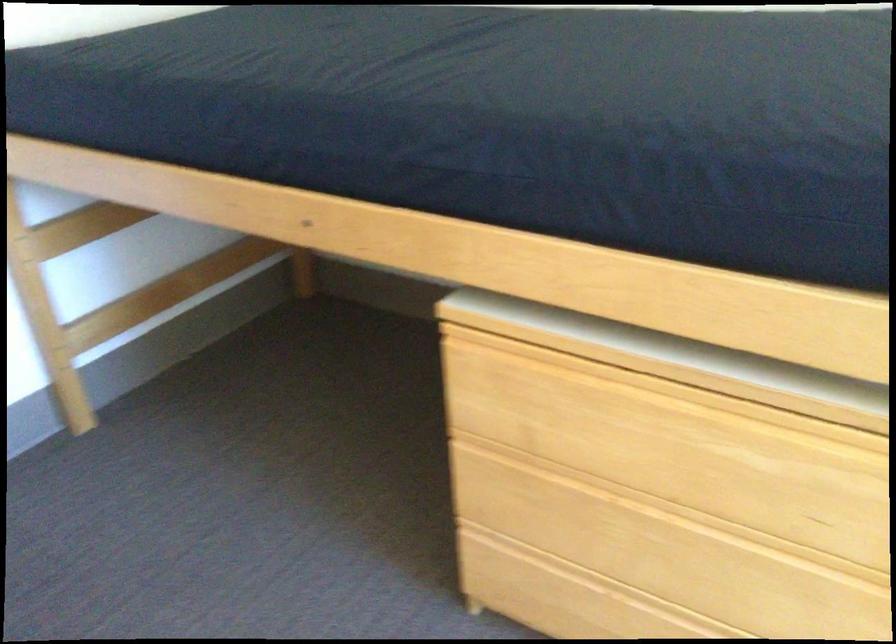
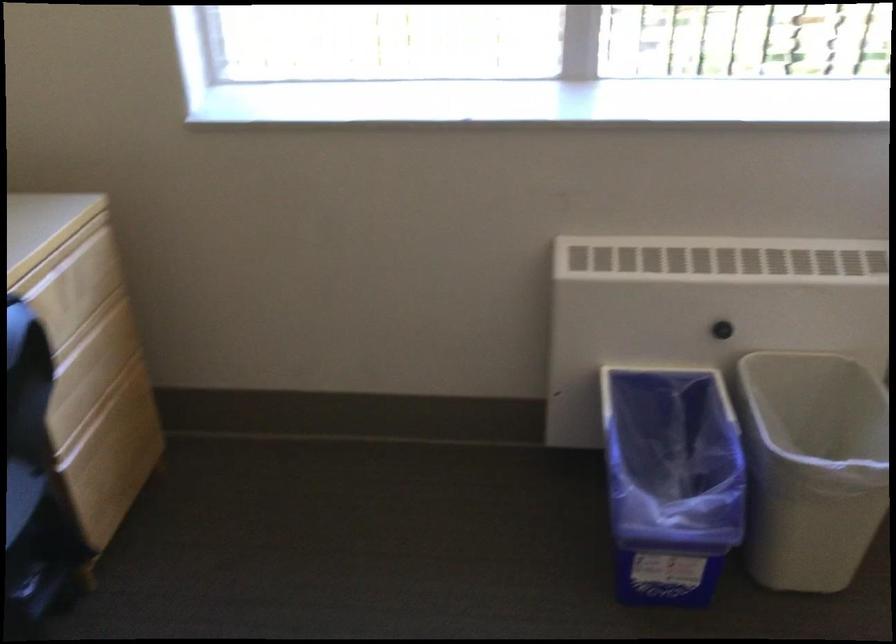
Based on the continuous images, in which direction is the camera rotating?

The camera's rotation is toward right-down.